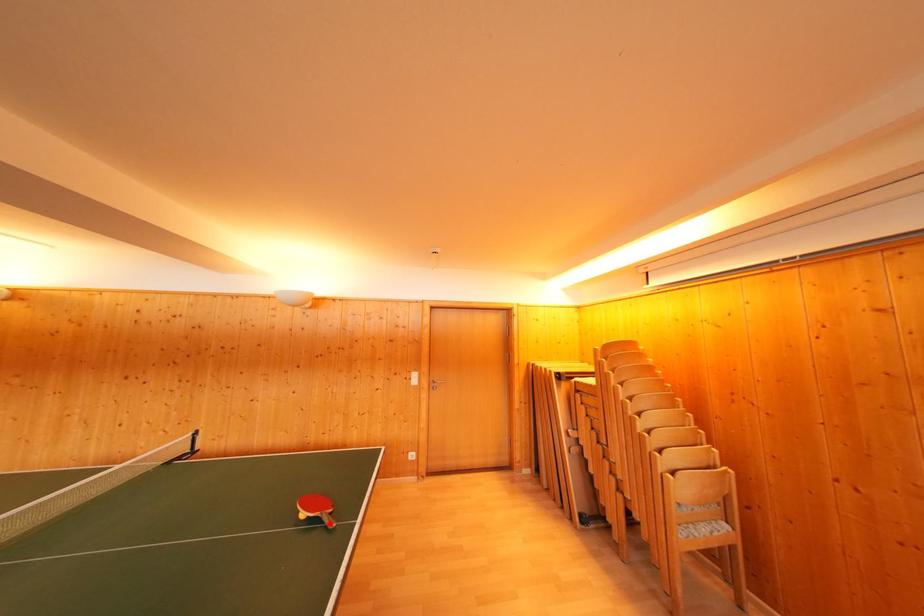
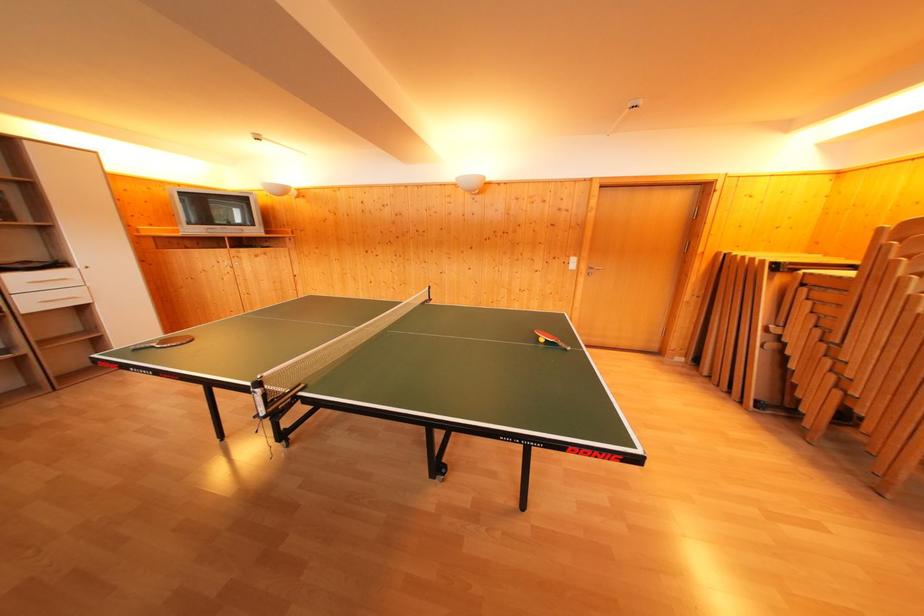
Question: I am providing you with two images of the same scene from different viewpoints. A red point is shown in image1. For the corresponding object point in image2, is it positioned nearer or farther from the camera?

Choices:
 (A) Nearer
 (B) Farther

Answer: (B)